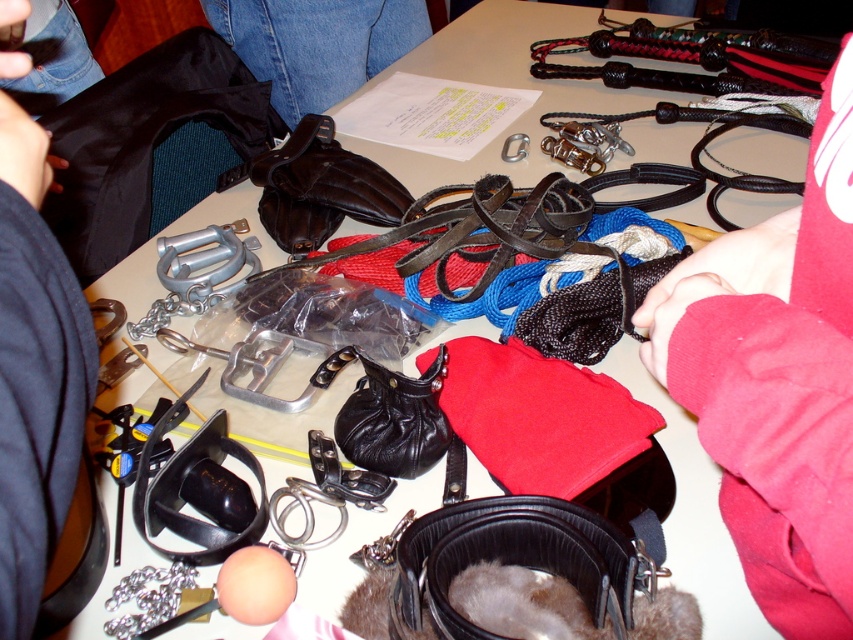
Question: Is red leather jacket at lower right thinner than black leather purse at center?

Choices:
 (A) no
 (B) yes

Answer: (B)

Question: Which point is farther to the camera?

Choices:
 (A) (22, 115)
 (B) (346, 419)
 (C) (729, 452)
 (D) (289, 40)

Answer: (D)

Question: Which point is farther to the camera?

Choices:
 (A) red leather jacket at lower right
 (B) black leather purse at center
 (C) jeans at upper center
 (D) red fabric sleeve at upper right

Answer: (C)

Question: Is jeans at upper center positioned behind black leather purse at center?

Choices:
 (A) yes
 (B) no

Answer: (A)

Question: Which is farther from the red leather jacket at lower right?

Choices:
 (A) jeans at upper center
 (B) red fabric sleeve at upper right

Answer: (A)

Question: Is red fabric sleeve at upper right positioned before black leather purse at center?

Choices:
 (A) no
 (B) yes

Answer: (B)